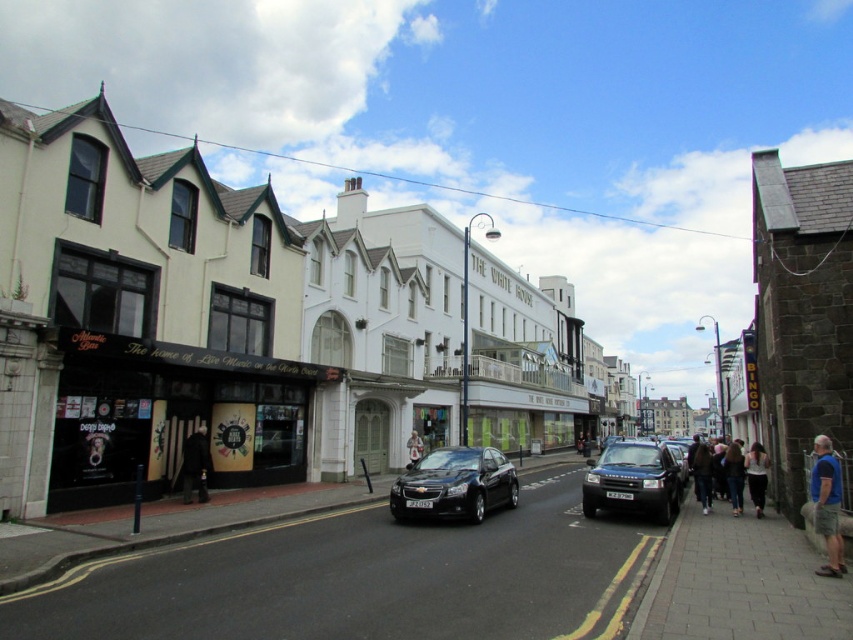
Is white matte building at center thinner than white cotton shirt at center?

No, white matte building at center is not thinner than white cotton shirt at center.

Is white matte building at center to the left of white cotton shirt at center from the viewer's perspective?

Correct, you'll find white matte building at center to the left of white cotton shirt at center.

Between point (158, 291) and point (416, 456), which one is positioned in front?

Positioned in front is point (158, 291).

Image resolution: width=853 pixels, height=640 pixels. Find the location of `white matte building at center`. white matte building at center is located at coordinates (250, 326).

Between shiny black sedan at center and white cotton shirt at center, which one appears on the left side from the viewer's perspective?

From the viewer's perspective, white cotton shirt at center appears more on the left side.

Between shiny black sedan at center and white cotton shirt at center, which one is positioned lower?

white cotton shirt at center

Identify the location of shiny black sedan at center. Image resolution: width=853 pixels, height=640 pixels. (454, 484).

Is black matte coat at center shorter than dark brown leather jacket at lower right?

No, black matte coat at center is not shorter than dark brown leather jacket at lower right.

Between black matte coat at center and dark brown leather jacket at lower right, which one appears on the left side from the viewer's perspective?

black matte coat at center is more to the left.

Does point (187, 445) come in front of point (701, 484)?

Yes.

The height and width of the screenshot is (640, 853). What are the coordinates of `black matte coat at center` in the screenshot? It's located at (195, 465).